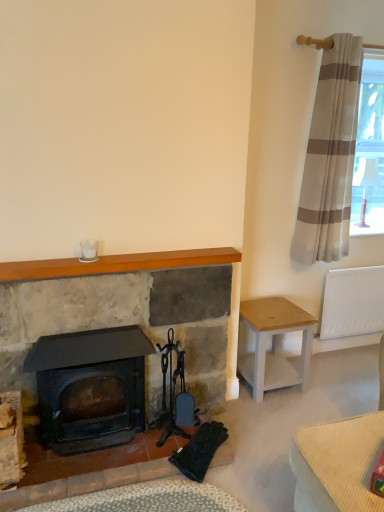
You are a GUI agent. You are given a task and a screenshot of the screen. Output one action in this format:
    pyautogui.click(x=<x>, y=<y>)
    Task: Click on the empty space that is to the right of matte black wood burning stove at center-left
    The image size is (384, 512).
    Given the screenshot: What is the action you would take?
    pyautogui.click(x=150, y=462)